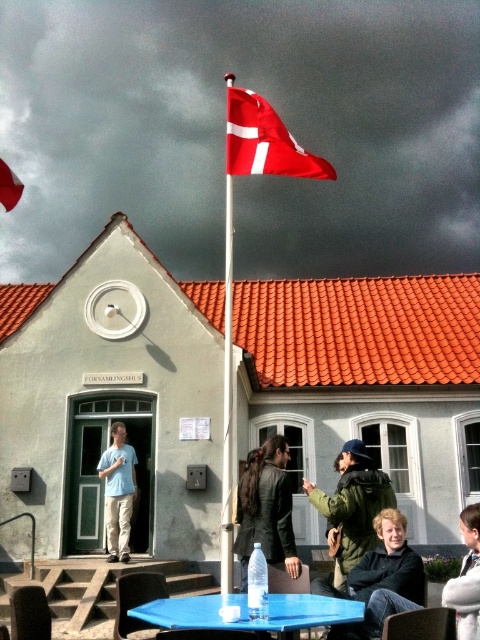
You are a delivery person standing at the entrance of the Assembly House. You need to deliver a package to the person wearing the green matte jacket at center and the person wearing the leather jacket at center. If your delivery cart is 2 meters wide, can you move between them to deliver the package?

The distance between the green matte jacket at center and the leather jacket at center is 2.49 meters. Since the delivery cart is 2 meters wide, it can fit through the space between them as 2.49 meters is greater than 2 meters.

You are standing at the entrance of the Assembly House and want to greet the person wearing the green matte jacket at center. In which direction should you walk relative to your current position?

The green matte jacket at center is located at coordinates 0.794 on the x axis and 0.733 on the y axis. Since you are at the entrance, which is at the lower part of the image, you should walk towards the upper right direction to reach the green matte jacket at center.

You are a photographer trying to capture a group photo of the people at the assembly house. You notice the leather jacket at center and the matte black jacket at lower right. Which jacket should you focus on to ensure the subject wearing it appears larger in your photo?

The matte black jacket at lower right has a greater width than the leather jacket at center, so focusing on it would make the subject appear larger in the photo.